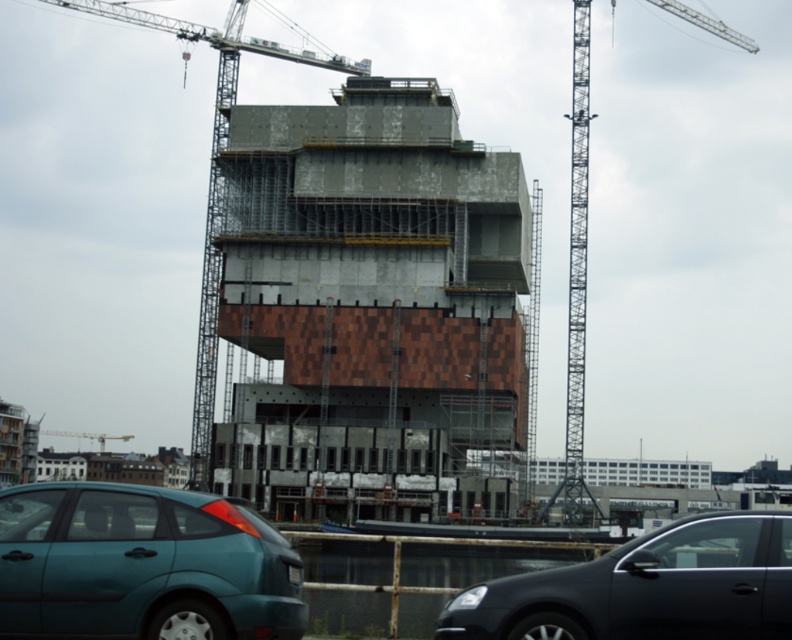
Measure the distance between point [568,412] and camera.

A distance of 147.26 meters exists between point [568,412] and camera.

Between metallic scaffolding at right and metallic gray crane at upper left, which one has less height?

Standing shorter between the two is metallic gray crane at upper left.

Which is behind, point (583, 332) or point (103, 451)?

The point (103, 451) is behind.

Find the location of a particular element. The width and height of the screenshot is (792, 640). metallic scaffolding at right is located at coordinates (577, 276).

Between teal matte hatchback at lower left and gray metallic crane at upper center, which one has less height?

Standing shorter between the two is teal matte hatchback at lower left.

Is teal matte hatchback at lower left bigger than gray metallic crane at upper center?

Incorrect, teal matte hatchback at lower left is not larger than gray metallic crane at upper center.

Between point (63, 560) and point (174, 211), which one is positioned behind?

Point (174, 211)

You are a GUI agent. You are given a task and a screenshot of the screen. Output one action in this format:
    pyautogui.click(x=<x>, y=<y>)
    Task: Click on the teal matte hatchback at lower left
    The height and width of the screenshot is (640, 792).
    Given the screenshot: What is the action you would take?
    pyautogui.click(x=143, y=564)

Does shiny black sedan at lower right have a greater width compared to metallic scaffolding at right?

No.

Between point (588, 596) and point (565, 497), which one is positioned behind?

The point (565, 497) is more distant.

Image resolution: width=792 pixels, height=640 pixels. Find the location of `shiny black sedan at lower right`. shiny black sedan at lower right is located at coordinates (646, 588).